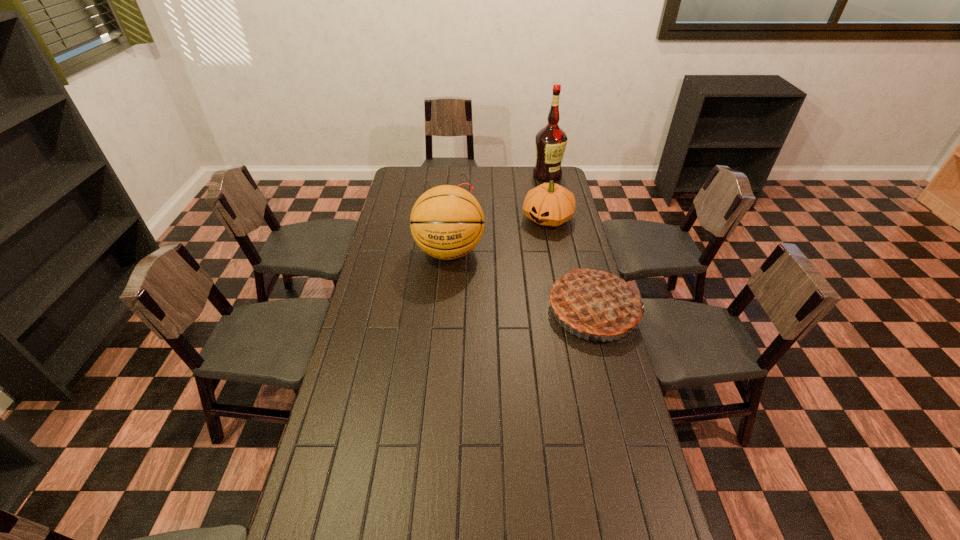
Find the location of a particular element. The image size is (960, 540). vacant space located on the label of the alcohol is located at coordinates (538, 214).

At what (x,y) coordinates should I click in order to perform the action: click on vacant space located 0.140m on the side of the gourd with the carved face. Please return your answer as a coordinate pair (x, y). Looking at the image, I should click on (523, 248).

The height and width of the screenshot is (540, 960). I want to click on vacant region located 0.060m on the side of the gourd with the carved face, so click(531, 239).

Locate an element on the screen. This screenshot has height=540, width=960. vacant space located on the side of the gourd with the carved face is located at coordinates (527, 244).

Where is `vacant area situated 0.310m on the front-facing side of the spectacles`? Image resolution: width=960 pixels, height=540 pixels. vacant area situated 0.310m on the front-facing side of the spectacles is located at coordinates (479, 237).

Image resolution: width=960 pixels, height=540 pixels. I want to click on vacant space located on the front-facing side of the spectacles, so click(x=468, y=220).

This screenshot has width=960, height=540. In order to click on vacant area situated 0.300m on the front-facing side of the spectacles in this screenshot , I will do `click(478, 236)`.

This screenshot has height=540, width=960. I want to click on alcohol at the far edge, so click(550, 141).

The height and width of the screenshot is (540, 960). I want to click on spectacles present at the far edge, so click(462, 174).

Find the location of a particular element. object located in the left edge section of the desktop is located at coordinates (462, 174).